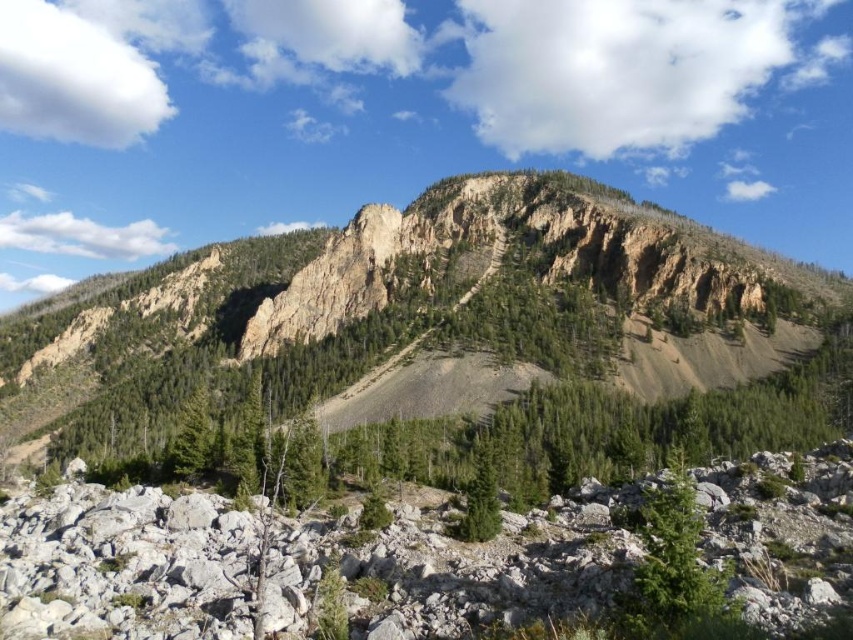
Question: Does brown rocky mountain at center have a lesser width compared to gray rock at lower center?

Choices:
 (A) no
 (B) yes

Answer: (A)

Question: Can you confirm if brown rocky mountain at center is wider than gray rock at lower center?

Choices:
 (A) no
 (B) yes

Answer: (B)

Question: Which object is positioned closest to the green matte tree at lower right?

Choices:
 (A) gray rock at lower center
 (B) green matte tree at center
 (C) brown rocky mountain at center

Answer: (A)

Question: Which object is the closest to the gray rock at lower center?

Choices:
 (A) green matte tree at center
 (B) brown rocky mountain at center

Answer: (A)

Question: Does gray rock at lower center appear on the left side of green matte tree at center?

Choices:
 (A) no
 (B) yes

Answer: (B)

Question: Estimate the real-world distances between objects in this image. Which object is farther from the green matte tree at lower right?

Choices:
 (A) green matte tree at center
 (B) gray rock at lower center
 (C) brown rocky mountain at center

Answer: (C)